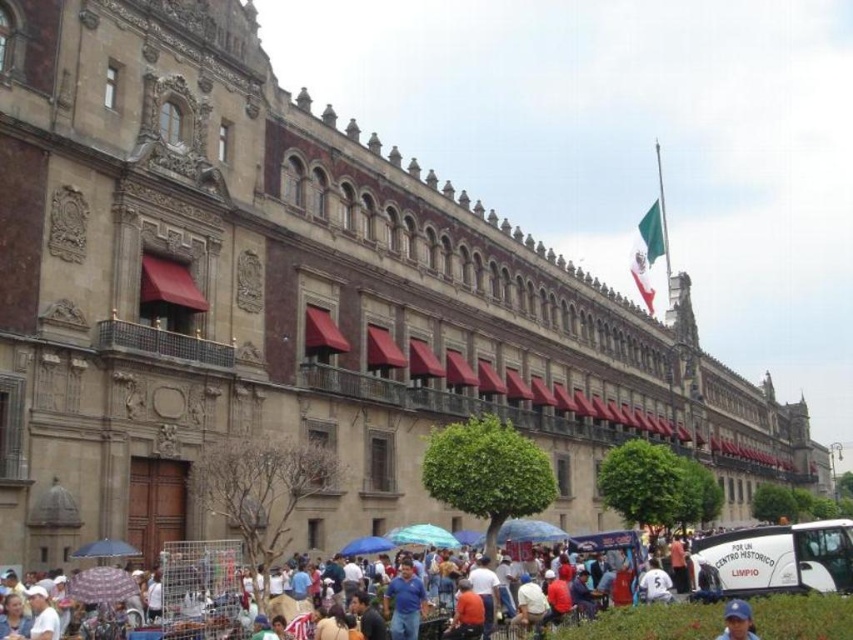
Question: Which point is farther to the camera?

Choices:
 (A) white cotton crowd at lower center
 (B) blue fabric cap at lower center

Answer: (A)

Question: Considering the real-world distances, which object is farthest from the blue fabric umbrella at lower center?

Choices:
 (A) transparent plastic umbrella at lower left
 (B) blue fabric cap at lower center
 (C) light blue fabric umbrella at lower center

Answer: (B)

Question: Is light blue fabric umbrella at lower center below blue fabric cap at lower center?

Choices:
 (A) yes
 (B) no

Answer: (A)

Question: Which of the following is the closest to the observer?

Choices:
 (A) (447, 540)
 (B) (115, 540)
 (C) (726, 602)
 (D) (596, 540)

Answer: (C)

Question: Does blue fabric cap at lower center have a lesser width compared to transparent plastic umbrella at lower left?

Choices:
 (A) yes
 (B) no

Answer: (B)

Question: In this image, where is light blue fabric umbrella at lower center located relative to transparent plastic umbrella at lower left?

Choices:
 (A) right
 (B) left

Answer: (A)